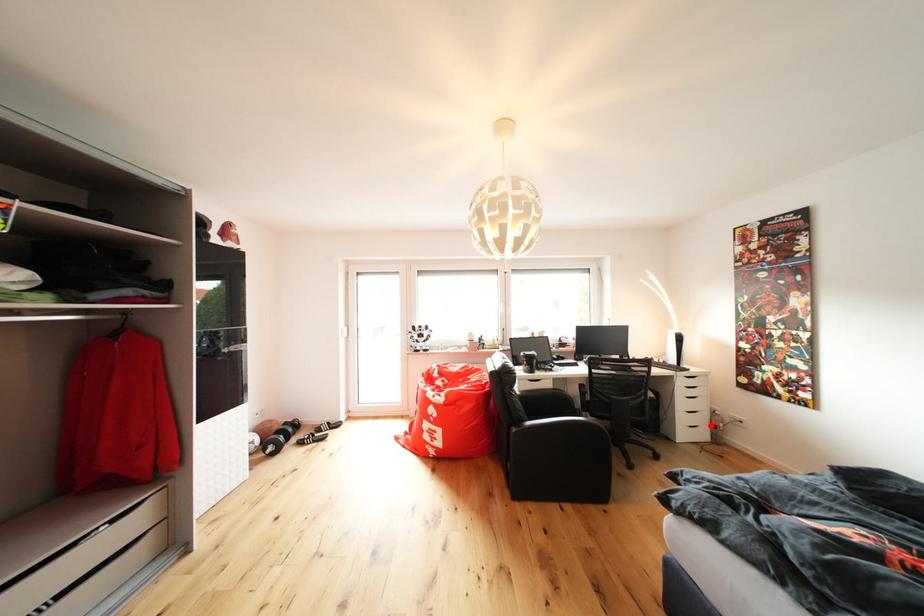
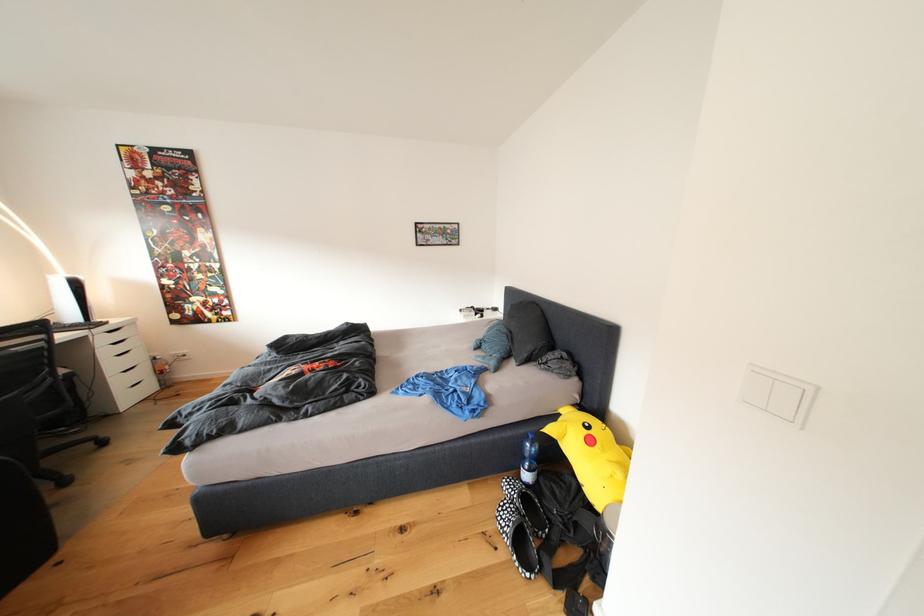
Find the pixel in the second image that matches the highlighted location in the first image.

(152, 379)